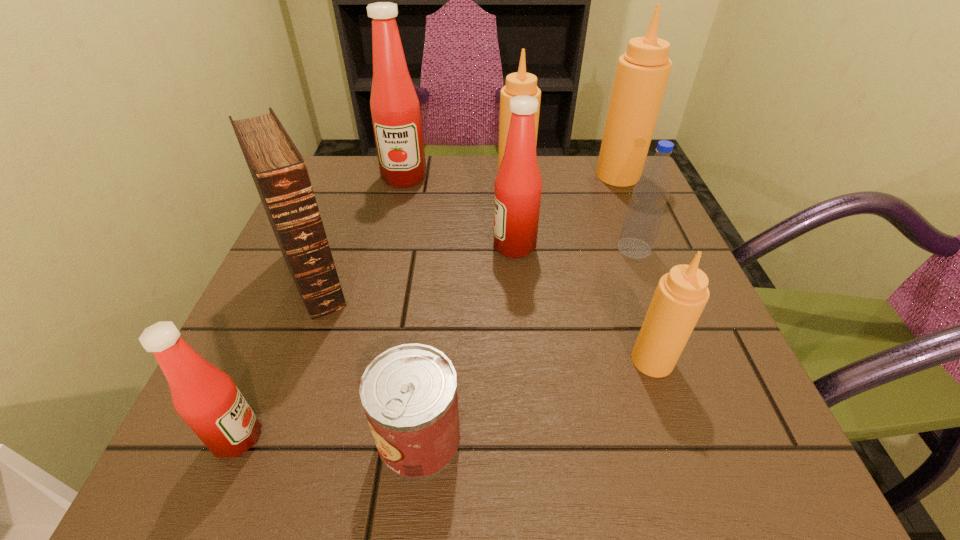
The image size is (960, 540). Identify the location of object located at the far right corner. (642, 73).

Identify the location of free location at the far edge. (560, 200).

This screenshot has height=540, width=960. I want to click on vacant space at the near edge, so click(467, 431).

In the image, there is a desktop. Where is `vacant space at the left edge`? vacant space at the left edge is located at coordinates (334, 234).

The height and width of the screenshot is (540, 960). In the image, there is a desktop. What are the coordinates of `vacant space at the right edge` in the screenshot? It's located at (600, 228).

Where is `free space at the far left corner of the desktop`? free space at the far left corner of the desktop is located at coordinates (315, 191).

Where is `free point between the water bottle and the second biggest red condiment`? free point between the water bottle and the second biggest red condiment is located at coordinates (574, 247).

The height and width of the screenshot is (540, 960). What are the coordinates of `vacant space that's between the second nearest condiment and the Bible` in the screenshot? It's located at (483, 320).

Image resolution: width=960 pixels, height=540 pixels. Find the location of `vacant area that lies between the can and the second biggest red condiment`. vacant area that lies between the can and the second biggest red condiment is located at coordinates (467, 342).

Identify the location of vacant space that is in between the rightmost red condiment and the fifth farthest condiment. The height and width of the screenshot is (540, 960). (584, 303).